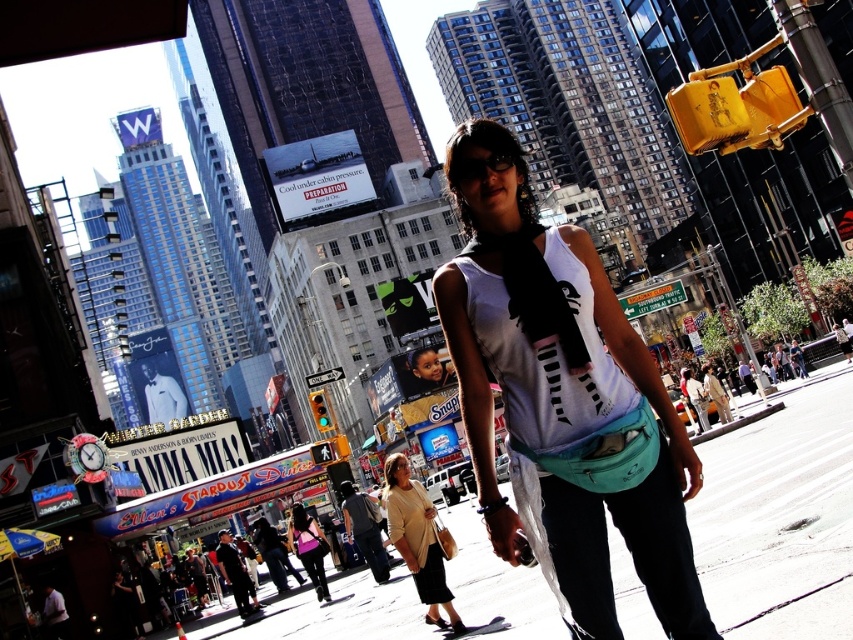
You are a photographer trying to capture the billboard advertisement in the background. To ensure the dark gray cotton shirt at lower center doesn not block your shot, where should you position yourself relative to the shirt?

The dark gray cotton shirt at lower center is located at point (x=364, y=531). To avoid blocking the billboard advertisement, position yourself to the left or right of the shirt, ensuring it doesn not obstruct the view of the billboard.

You are a delivery drone flying over the city. You need to land on the smooth asphalt at lower center to drop off a package. However, there is a beige fabric purse at center in the way. Can you safely land on the asphalt without hitting the purse?

The smooth asphalt at lower center is closer to the viewer than the beige fabric purse at center, so the drone can safely land on the asphalt as the purse is further away and not obstructing the landing area.

You are a delivery person who needs to place a package on the ground. You see the smooth asphalt at lower center and the beige fabric purse at center. Which surface can you use to place the package without it getting dirty?

The smooth asphalt at lower center is located above the beige fabric purse at center, so placing the package on the smooth asphalt at lower center would be better as it is higher and less likely to get dirty compared to the lower positioned beige fabric purse at center.